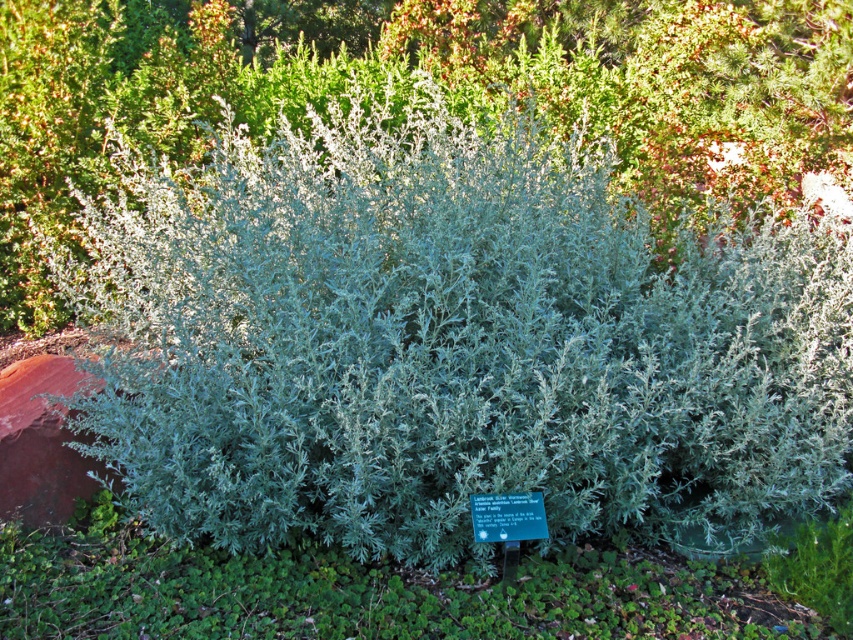
You are standing in a garden and see the point marked at coordinates (407, 77). What is located at that point?

The point at coordinates (407, 77) marks silvery green foliage at center.